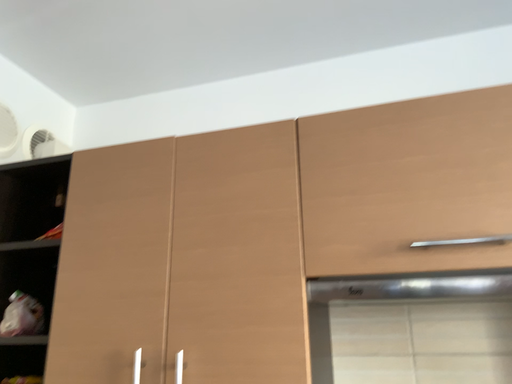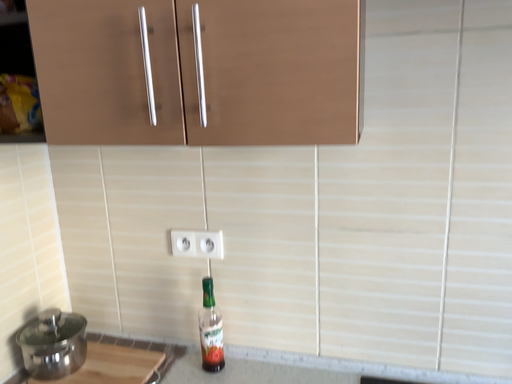
Question: How did the camera likely rotate when shooting the video?

Choices:
 (A) rotated upward
 (B) rotated downward

Answer: (B)